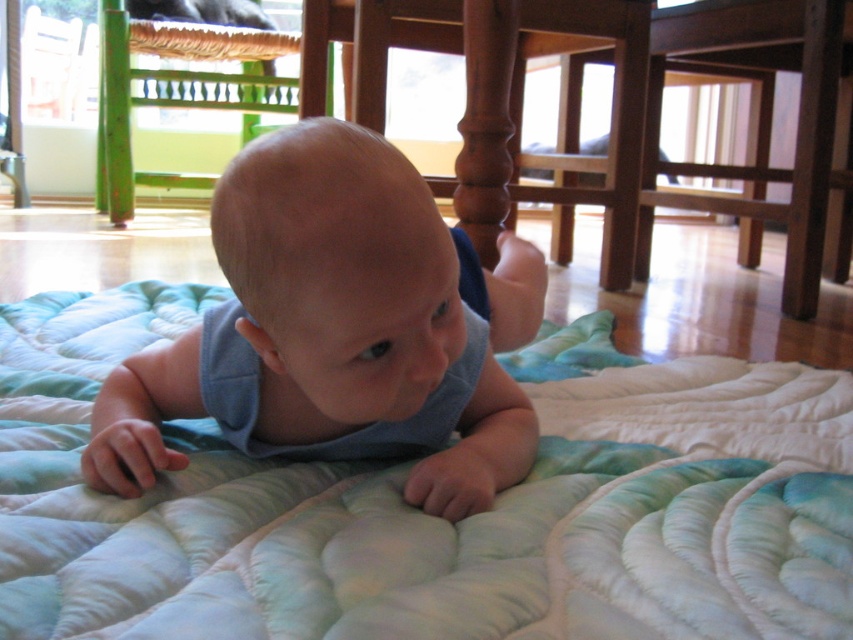
Measure the distance from light blue quilt at center to green wood chair at upper left.

They are 4.96 feet apart.

Between light blue quilt at center and green wood chair at upper left, which one is positioned lower?

light blue quilt at center is below.

Does point (25, 540) lie behind point (202, 93)?

No.

Where is `light blue quilt at center`? This screenshot has height=640, width=853. light blue quilt at center is located at coordinates (427, 516).

Between point (109, 410) and point (126, 42), which one is positioned behind?

Positioned behind is point (126, 42).

Where is `blue fabric baby at center`? blue fabric baby at center is located at coordinates point(328,328).

Who is more forward, (x=288, y=282) or (x=144, y=48)?

Point (x=288, y=282) is in front.

Locate an element on the screen. Image resolution: width=853 pixels, height=640 pixels. blue fabric baby at center is located at coordinates (328, 328).

Does light blue quilt at center appear over blue fabric baby at center?

No, light blue quilt at center is not above blue fabric baby at center.

Can you confirm if light blue quilt at center is taller than blue fabric baby at center?

No.

Which is behind, point (502, 524) or point (438, 381)?

Positioned behind is point (438, 381).

At what (x,y) coordinates should I click in order to perform the action: click on light blue quilt at center. Please return your answer as a coordinate pair (x, y). This screenshot has width=853, height=640. Looking at the image, I should click on (427, 516).